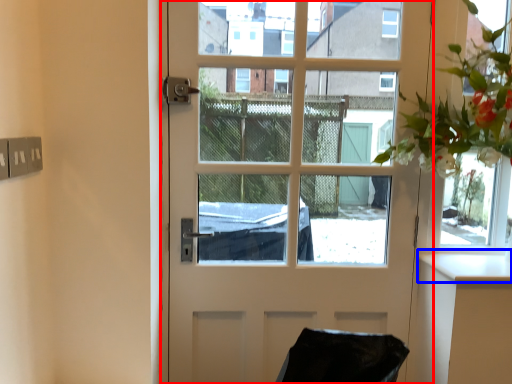
Question: Which object is closer to the camera taking this photo, door (highlighted by a red box) or counter top (highlighted by a blue box)?

Choices:
 (A) door
 (B) counter top

Answer: (B)